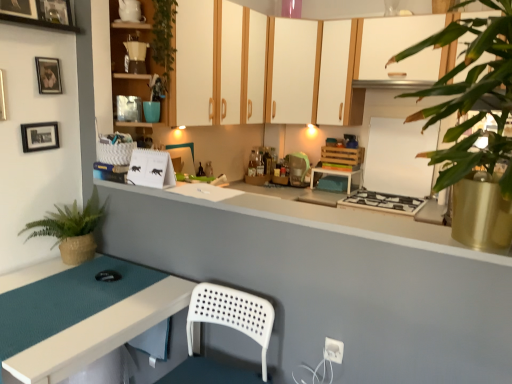
This screenshot has height=384, width=512. What do you see at coordinates (152, 111) in the screenshot? I see `teal glass jar at upper center` at bounding box center [152, 111].

Describe the element at coordinates (226, 326) in the screenshot. The width and height of the screenshot is (512, 384). I see `white plastic chair at lower center` at that location.

What do you see at coordinates (333, 350) in the screenshot? I see `white plastic electric outlet at lower center` at bounding box center [333, 350].

Where is `wooden picture frame at upper left, the 3th picture frame when ordered from bottom to top`? Image resolution: width=512 pixels, height=384 pixels. wooden picture frame at upper left, the 3th picture frame when ordered from bottom to top is located at coordinates (19, 8).

The image size is (512, 384). Describe the element at coordinates (338, 176) in the screenshot. I see `wooden table at center, placed as the first table when sorted from top to bottom` at that location.

The height and width of the screenshot is (384, 512). Describe the element at coordinates (40, 136) in the screenshot. I see `black matte picture frame at upper left, placed as the 3th picture frame when sorted from top to bottom` at that location.

This screenshot has width=512, height=384. Identify the location of white glossy teapot at upper center, the second appliance ordered from the bottom. (130, 10).

Where is `teal glass jar at upper center`? teal glass jar at upper center is located at coordinates (152, 111).

I want to click on exhaust hood on the right of white glossy teapot at upper center, the second appliance ordered from the bottom, so click(392, 84).

Is white glossy exhaust hood at upper center bigger than white glossy teapot at upper center, the first appliance viewed from the front?

Yes, white glossy exhaust hood at upper center is bigger than white glossy teapot at upper center, the first appliance viewed from the front.

Based on the photo, which object is thinner, white glossy exhaust hood at upper center or white glossy teapot at upper center, the second appliance ordered from the bottom?

With smaller width is white glossy teapot at upper center, the second appliance ordered from the bottom.

Can you confirm if braided straw pot at left, which is the second houseplant from right to left, is bigger than matte wood cabinet at upper left, the first cabinetry viewed from the left?

Incorrect, braided straw pot at left, which is the second houseplant from right to left, is not larger than matte wood cabinet at upper left, the first cabinetry viewed from the left.

From the image's perspective, starting from the matte wood cabinet at upper left, marked as the third cabinetry in a back-to-front arrangement, which houseplant is the 2nd one below? Please provide its 2D coordinates.

[(71, 229)]

Is point (73, 226) closer to viewer compared to point (158, 67)?

That is True.

Would you say braided straw pot at left, the second houseplant in the front-to-back sequence, is inside or outside matte wood cabinet at upper left, which is the 3th cabinetry from right to left?

braided straw pot at left, the second houseplant in the front-to-back sequence, is located beyond the bounds of matte wood cabinet at upper left, which is the 3th cabinetry from right to left.

From a real-world perspective, which cabinetry is the 2nd one underneath the white matte cabinet at upper center, the second cabinetry from the right? Please provide its 2D coordinates.

[(125, 53)]

Which of these two, matte wood cabinet at upper left, the first cabinetry viewed from the left, or white matte cabinet at upper center, the second cabinetry from the right, is bigger?

white matte cabinet at upper center, the second cabinetry from the right, is bigger.

Does point (169, 66) appear closer or farther from the camera than point (301, 62)?

Point (169, 66) is positioned closer to the camera compared to point (301, 62).

Which of these two, matte wood cabinet at upper left, marked as the third cabinetry in a back-to-front arrangement, or white matte cabinet at upper center, the second cabinetry in the back-to-front sequence, is thinner?

matte wood cabinet at upper left, marked as the third cabinetry in a back-to-front arrangement.

From the image's perspective, which one is positioned lower, green leafy plant at upper right, which appears as the second houseplant when viewed from the left, or white plastic electric outlet at lower center?

white plastic electric outlet at lower center is shown below in the image.

Does point (481, 89) come farther from viewer compared to point (327, 357)?

No, (481, 89) is closer to viewer.

In the scene shown: Is green leafy plant at upper right, placed as the 1th houseplant when sorted from right to left, wider or thinner than white plastic electric outlet at lower center?

Considering their sizes, green leafy plant at upper right, placed as the 1th houseplant when sorted from right to left, looks broader than white plastic electric outlet at lower center.

Who is smaller, white glossy stove at center, the 2th appliance viewed from the left, or white glossy exhaust hood at upper center?

white glossy exhaust hood at upper center.

Is white glossy stove at center, positioned as the first appliance in right-to-left order, not close to white glossy exhaust hood at upper center?

They are positioned close to each other.

Between white glossy stove at center, which is the first appliance in back-to-front order, and white glossy exhaust hood at upper center, which one appears on the right side from the viewer's perspective?

Positioned to the right is white glossy stove at center, which is the first appliance in back-to-front order.

Is white glossy exhaust hood at upper center at the back of white glossy stove at center, the 2th appliance viewed from the left?

No, white glossy stove at center, the 2th appliance viewed from the left, is not facing the opposite direction of white glossy exhaust hood at upper center.

From the image's perspective, is white plastic electric outlet at lower center under braided straw pot at left, which is the second houseplant from right to left?

Yes, from the image's perspective, white plastic electric outlet at lower center is beneath braided straw pot at left, which is the second houseplant from right to left.

Is white plastic electric outlet at lower center far away from braided straw pot at left, the second houseplant in the front-to-back sequence?

That's right, there is a large distance between white plastic electric outlet at lower center and braided straw pot at left, the second houseplant in the front-to-back sequence.

Does white plastic electric outlet at lower center turn towards braided straw pot at left, the 1th houseplant when ordered from left to right?

No.

Which of these two, white plastic electric outlet at lower center or braided straw pot at left, the second houseplant in the front-to-back sequence, is thinner?

white plastic electric outlet at lower center is thinner.

Between matte black picture frame at upper left, which is the 2th picture frame from top to bottom, and teal matte table at lower left, which appears as the second table when viewed from the top, which one has larger size?

Bigger between the two is teal matte table at lower left, which appears as the second table when viewed from the top.

Would you say matte black picture frame at upper left, which appears as the second picture frame when ordered from the bottom, is inside or outside teal matte table at lower left, which appears as the second table when viewed from the top?

matte black picture frame at upper left, which appears as the second picture frame when ordered from the bottom, is not enclosed by teal matte table at lower left, which appears as the second table when viewed from the top.

Based on the photo, from the image's perspective, is matte black picture frame at upper left, which is the 2th picture frame from top to bottom, located above teal matte table at lower left, the 1th table in the left-to-right sequence?

Yes, from the image's perspective, matte black picture frame at upper left, which is the 2th picture frame from top to bottom, is above teal matte table at lower left, the 1th table in the left-to-right sequence.

Is matte black picture frame at upper left, which appears as the second picture frame when ordered from the bottom, positioned with its back to teal matte table at lower left, the 2th table positioned from the back?

matte black picture frame at upper left, which appears as the second picture frame when ordered from the bottom, does not have its back to teal matte table at lower left, the 2th table positioned from the back.

At what (x,y) coordinates should I click in order to perform the action: click on appliance in front of the white glossy exhaust hood at upper center. Please return your answer as a coordinate pair (x, y). Looking at the image, I should click on (130, 10).

From a real-world perspective, starting from the matte wood cabinet at upper left, the 1th cabinetry from the front, which houseplant is the 2nd one below it? Please provide its 2D coordinates.

[(71, 229)]

Based on their spatial positions, is matte yellow coffee maker at upper center or white plastic chair at lower center closer to wooden table at center, the 1th table viewed from the right?

matte yellow coffee maker at upper center is positioned closer to the anchor wooden table at center, the 1th table viewed from the right.

Estimate the real-world distances between objects in this image. Which object is further from matte black picture frame at upper left, which appears as the second picture frame when ordered from the bottom, matte wood cabinet at upper left, the 1th cabinetry from the front, or white glossy exhaust hood at upper center?

white glossy exhaust hood at upper center.

Looking at the image, which one is located further to braided straw pot at left, which is the 1th houseplant in back-to-front order, green leafy plant at upper right, which ranks as the 1th houseplant in front-to-back order, or black matte picture frame at upper left, which appears as the 1th picture frame when ordered from the bottom?

green leafy plant at upper right, which ranks as the 1th houseplant in front-to-back order, is positioned further to the anchor braided straw pot at left, which is the 1th houseplant in back-to-front order.

Considering their positions, is wooden table at center, which ranks as the 2th table in bottom-to-top order, positioned further to teal glass jar at upper center than matte wood cabinet at upper left, the first cabinetry viewed from the left?

wooden table at center, which ranks as the 2th table in bottom-to-top order, is positioned further to the anchor teal glass jar at upper center.

Considering their positions, is teal matte table at lower left, the 1th table in the left-to-right sequence, positioned closer to braided straw pot at left, which is the 1th houseplant in back-to-front order, than matte black picture frame at upper left, which appears as the second picture frame when ordered from the bottom?

Based on the image, teal matte table at lower left, the 1th table in the left-to-right sequence, appears to be nearer to braided straw pot at left, which is the 1th houseplant in back-to-front order.

Which object lies further to the anchor point white plastic chair at lower center, white glossy exhaust hood at upper center or braided straw pot at left, the second houseplant in the front-to-back sequence?

The object further to white plastic chair at lower center is white glossy exhaust hood at upper center.

From the picture: Looking at the image, which one is located closer to wooden picture frame at upper left, the 3th picture frame when ordered from bottom to top, white glossy stove at center, arranged as the 2th appliance when viewed from the front, or braided straw pot at left, which is the second houseplant from right to left?

braided straw pot at left, which is the second houseplant from right to left, lies closer to wooden picture frame at upper left, the 3th picture frame when ordered from bottom to top, than the other object.

Based on their spatial positions, is wooden table at center, positioned as the second table in front-to-back order, or white glossy exhaust hood at upper center closer to white plastic electric outlet at lower center?

wooden table at center, positioned as the second table in front-to-back order.

The height and width of the screenshot is (384, 512). I want to click on teal located between black matte picture frame at upper left, placed as the 3th picture frame when sorted from top to bottom, and green leafy plant at upper right, which ranks as the 1th houseplant in front-to-back order, in the left-right direction, so click(152, 111).

Where is `electric outlet between black matte picture frame at upper left, placed as the 3th picture frame when sorted from top to bottom, and white matte cabinet at upper center, placed as the 1th cabinetry when sorted from right to left`? Image resolution: width=512 pixels, height=384 pixels. electric outlet between black matte picture frame at upper left, placed as the 3th picture frame when sorted from top to bottom, and white matte cabinet at upper center, placed as the 1th cabinetry when sorted from right to left is located at coordinates (333, 350).

Where is `electric outlet between green leafy plant at upper right, which ranks as the 1th houseplant in front-to-back order, and white glossy stove at center, the 2th appliance viewed from the left, from front to back`? electric outlet between green leafy plant at upper right, which ranks as the 1th houseplant in front-to-back order, and white glossy stove at center, the 2th appliance viewed from the left, from front to back is located at coordinates (333, 350).

At what (x,y) coordinates should I click in order to perform the action: click on table between wooden picture frame at upper left, the 3th picture frame when ordered from bottom to top, and green leafy plant at upper right, placed as the second houseplant when sorted from back to front. Please return your answer as a coordinate pair (x, y). The height and width of the screenshot is (384, 512). Looking at the image, I should click on tap(99, 332).